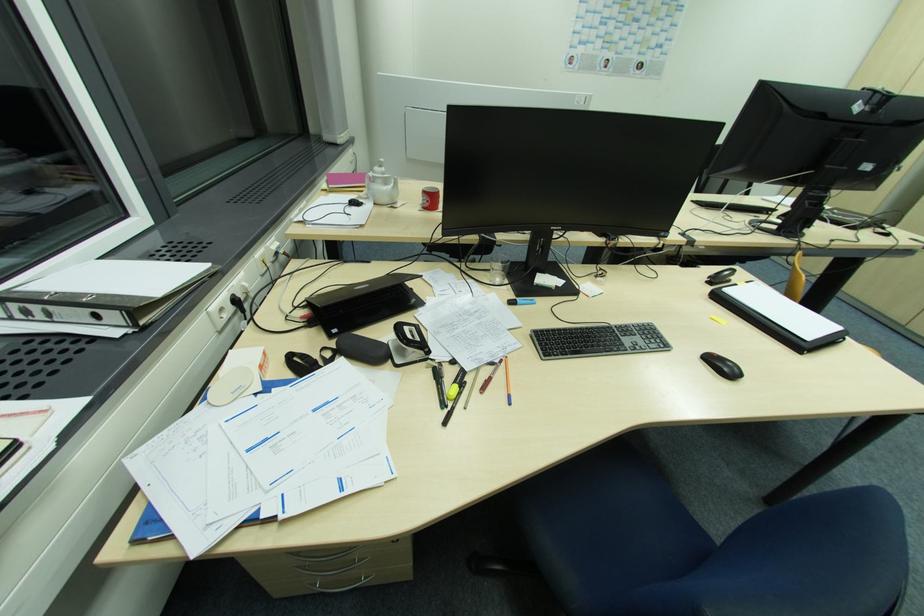
This screenshot has height=616, width=924. Describe the element at coordinates (725, 368) in the screenshot. I see `the black computer mouse` at that location.